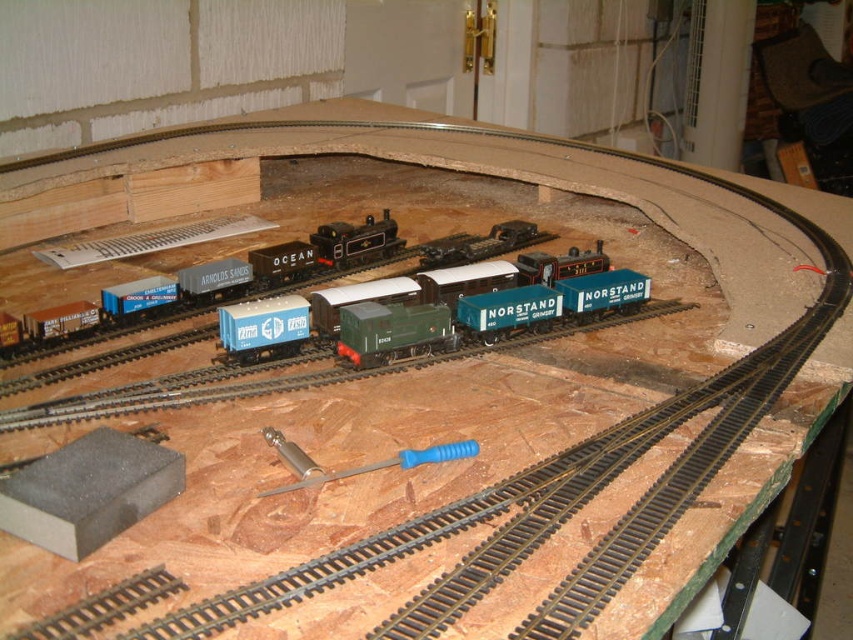
I want to click on blue plastic screwdriver at center, so click(x=357, y=467).

Which of these two, blue plastic screwdriver at center or teal matte freight car at center, stands shorter?

blue plastic screwdriver at center

Does point (293, 483) lie behind point (575, 285)?

No, (293, 483) is closer to viewer.

Locate an element on the screen. blue plastic screwdriver at center is located at coordinates (357, 467).

Which is behind, point (47, 353) or point (602, 301)?

The point (602, 301) is more distant.

Identify the location of blue/glossy freight car at center. The width and height of the screenshot is (853, 640). (236, 280).

Identify the location of blue/glossy freight car at center. The width and height of the screenshot is (853, 640). coord(236,280).

Does teal matte train car at center have a lesser height compared to teal matte freight car at center?

No, teal matte train car at center is not shorter than teal matte freight car at center.

Which is below, teal matte train car at center or teal matte freight car at center?

Positioned lower is teal matte train car at center.

Is point (529, 291) closer to viewer compared to point (596, 273)?

Yes, it is.

The height and width of the screenshot is (640, 853). I want to click on teal matte train car at center, so 506,310.